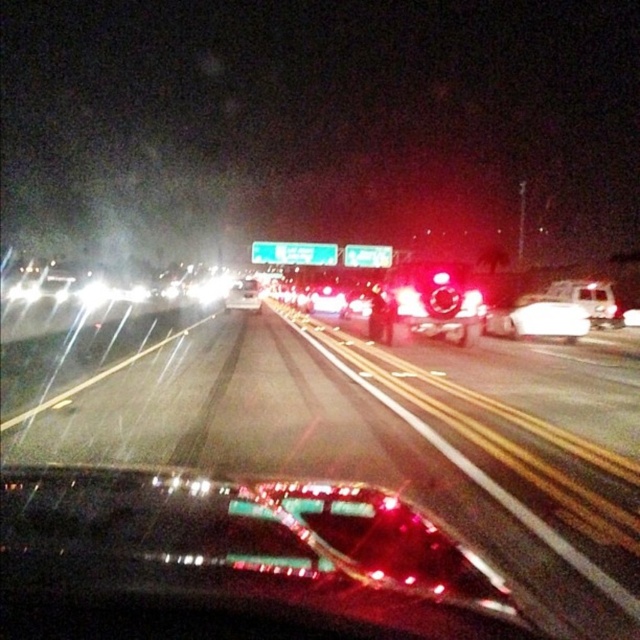
Between point (515, 532) and point (564, 285), which one is positioned in front?

Positioned in front is point (515, 532).

Is glossy reflective car at center positioned in front of metallic silver ambulance at right?

Yes, it is in front of metallic silver ambulance at right.

Who is more forward, (77,600) or (602,292)?

Positioned in front is point (77,600).

Locate an element on the screen. The image size is (640, 640). glossy reflective car at center is located at coordinates (307, 493).

Between glossy reflective car at center and glossy plastic car at center, which one has less height?

glossy plastic car at center is shorter.

Is glossy reflective car at center smaller than glossy plastic car at center?

Actually, glossy reflective car at center might be larger than glossy plastic car at center.

Which is behind, point (566, 445) or point (36, 488)?

Point (566, 445)

The height and width of the screenshot is (640, 640). I want to click on glossy reflective car at center, so click(307, 493).

Between glossy reflective car at center and metallic silver car at center, which one is positioned lower?

glossy reflective car at center

Who is more distant from viewer, (413, 547) or (236, 305)?

Positioned behind is point (236, 305).

I want to click on glossy reflective car at center, so click(x=307, y=493).

You are a GUI agent. You are given a task and a screenshot of the screen. Output one action in this format:
    pyautogui.click(x=<x>, y=<y>)
    Task: Click on the glossy reflective car at center
    The height and width of the screenshot is (640, 640).
    Given the screenshot: What is the action you would take?
    pyautogui.click(x=307, y=493)